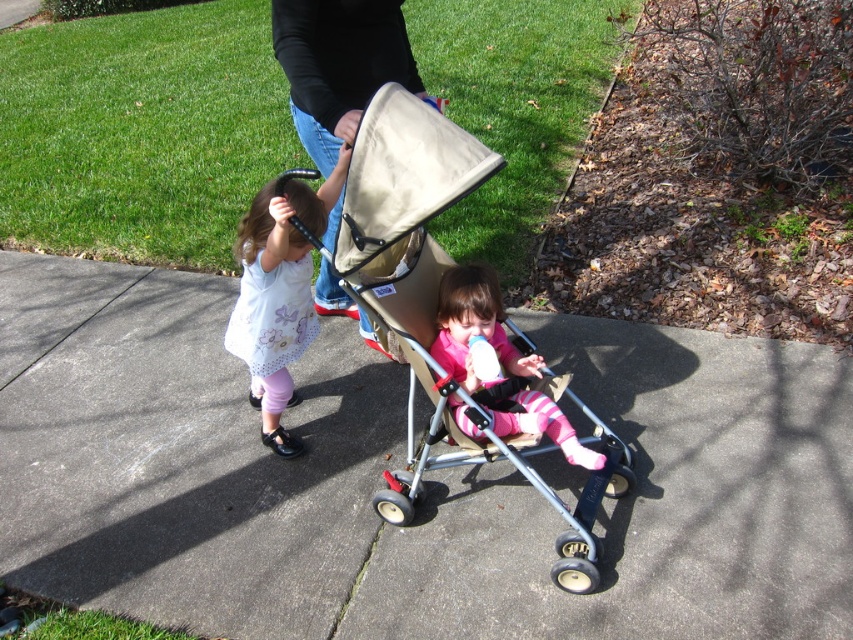
Can you confirm if gray concrete pavement at center is positioned below beige fabric stroller at center?

Yes, gray concrete pavement at center is below beige fabric stroller at center.

Image resolution: width=853 pixels, height=640 pixels. What do you see at coordinates (399, 461) in the screenshot? I see `gray concrete pavement at center` at bounding box center [399, 461].

Is point (624, 512) less distant than point (405, 493)?

No.

I want to click on gray concrete pavement at center, so click(399, 461).

Does gray concrete pavement at center have a larger size compared to white dotted dress at left?

Yes.

What do you see at coordinates (399, 461) in the screenshot? I see `gray concrete pavement at center` at bounding box center [399, 461].

Who is more distant from viewer, (537, 321) or (267, 276)?

The point (537, 321) is more distant.

The image size is (853, 640). In order to click on gray concrete pavement at center in this screenshot , I will do `click(399, 461)`.

Based on the photo, can you confirm if white dotted dress at left is positioned below pink fleece jacket at center?

Actually, white dotted dress at left is above pink fleece jacket at center.

Which of these two, white dotted dress at left or pink fleece jacket at center, stands shorter?

Standing shorter between the two is pink fleece jacket at center.

Is point (289, 230) more distant than point (521, 419)?

No.

This screenshot has height=640, width=853. Identify the location of white dotted dress at left. 277,294.